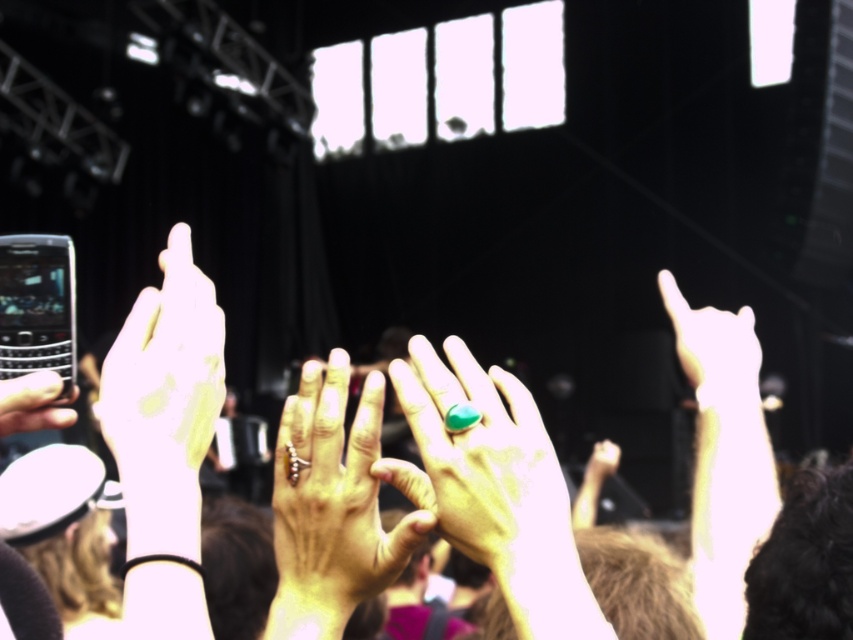
You are at a concert and want to know how far the point at coordinates point [543,497] is from you. Can you determine the distance?

The point [543,497] is 28.96 inches away from the viewer.

You are a photographer at the concert and want to capture a closeup of the emerald green stone ring at center and the yellow matte ring at left. Which ring will appear smaller in the photo?

The emerald green stone ring at center will appear smaller in the photo because it occupies less space than the yellow matte ring at left.